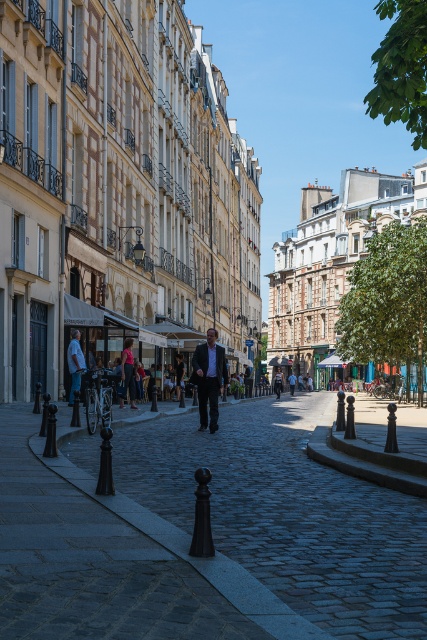
You are standing at the center of the street and want to greet the person wearing the light blue shirt at left. In which direction should you walk to reach them?

You should walk to the left to reach the light blue shirt at left since their position is at point (75, 364), which is on the left side of the street.